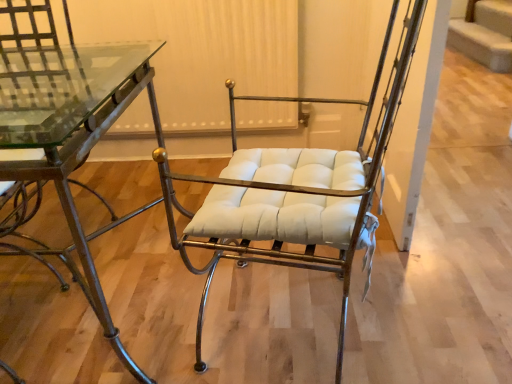
Describe the element at coordinates (72, 130) in the screenshot. The image size is (512, 384). I see `metallic glass table at left` at that location.

This screenshot has height=384, width=512. I want to click on metallic glass table at left, so click(x=72, y=130).

What do you see at coordinates (297, 191) in the screenshot? I see `white leather chair at center` at bounding box center [297, 191].

In order to face white leather chair at center, should I rotate leftwards or rightwards?

To face it directly, rotate right by 5.608 degrees.

Identify the location of white leather chair at center. The height and width of the screenshot is (384, 512). (297, 191).

You are a GUI agent. You are given a task and a screenshot of the screen. Output one action in this format:
    pyautogui.click(x=<x>, y=<y>)
    Task: Click on the metallic glass table at left
    This screenshot has height=384, width=512.
    Given the screenshot: What is the action you would take?
    pyautogui.click(x=72, y=130)

Considering the positions of objects white leather chair at center and metallic glass table at left in the image provided, who is more to the right, white leather chair at center or metallic glass table at left?

white leather chair at center is more to the right.

Is the depth of white leather chair at center greater than that of metallic glass table at left?

No, white leather chair at center is closer to the camera.

Does point (300, 170) lie behind point (39, 115)?

No, it is not.

From the image's perspective, which object appears higher, white leather chair at center or metallic glass table at left?

white leather chair at center appears higher in the image.

From a real-world perspective, is white leather chair at center above or below metallic glass table at left?

Clearly, from a real-world perspective, white leather chair at center is above metallic glass table at left.

Is white leather chair at center wider or thinner than metallic glass table at left?

Clearly, white leather chair at center has less width compared to metallic glass table at left.

Can you confirm if white leather chair at center is shorter than metallic glass table at left?

In fact, white leather chair at center may be taller than metallic glass table at left.

Who is smaller, white leather chair at center or metallic glass table at left?

white leather chair at center is smaller.

Is white leather chair at center not within metallic glass table at left?

That's correct, white leather chair at center is outside of metallic glass table at left.

Is white leather chair at center far away from metallic glass table at left?

No, white leather chair at center is not far from metallic glass table at left.

Is white leather chair at center turned away from metallic glass table at left?

No.

Measure the distance from white leather chair at center to metallic glass table at left.

The distance of white leather chair at center from metallic glass table at left is 32.60 inches.

Locate an element on the screen. chair on the right of metallic glass table at left is located at coordinates (297, 191).

Which is more to the right, metallic glass table at left or white leather chair at center?

white leather chair at center is more to the right.

Is metallic glass table at left closer to camera compared to white leather chair at center?

No, it is behind white leather chair at center.

Considering the points (127, 360) and (362, 138), which point is in front, point (127, 360) or point (362, 138)?

Point (127, 360)

From the image's perspective, between metallic glass table at left and white leather chair at center, who is located below?

metallic glass table at left.

From a real-world perspective, is metallic glass table at left positioned above or below white leather chair at center?

From a real-world perspective, metallic glass table at left is physically below white leather chair at center.

Is metallic glass table at left wider or thinner than white leather chair at center?

Clearly, metallic glass table at left has more width compared to white leather chair at center.

Can you confirm if metallic glass table at left is taller than white leather chair at center?

In fact, metallic glass table at left may be shorter than white leather chair at center.

Between metallic glass table at left and white leather chair at center, which one has smaller size?

With smaller size is white leather chair at center.

Is metallic glass table at left not inside white leather chair at center?

Yes, metallic glass table at left is outside of white leather chair at center.

Is metallic glass table at left far away from white leather chair at center?

No.

Based on the photo, is metallic glass table at left turned away from white leather chair at center?

No.

How far apart are metallic glass table at left and white leather chair at center?

They are 32.60 inches apart.

You are a GUI agent. You are given a task and a screenshot of the screen. Output one action in this format:
    pyautogui.click(x=<x>, y=<y>)
    Task: Click on the chair on the right of metallic glass table at left
    
    Given the screenshot: What is the action you would take?
    pyautogui.click(x=297, y=191)

Identify the location of table that is under the white leather chair at center (from a real-world perspective). The height and width of the screenshot is (384, 512). (72, 130).

The height and width of the screenshot is (384, 512). In order to click on chair on the right of metallic glass table at left in this screenshot , I will do `click(297, 191)`.